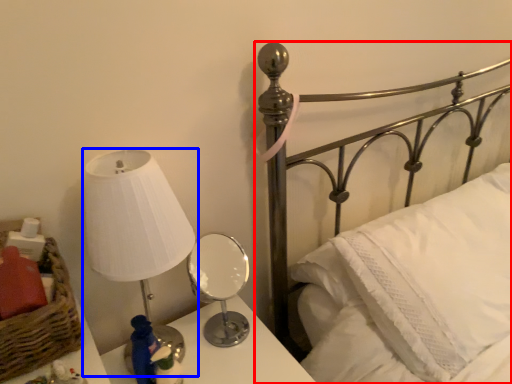
Question: Among these objects, which one is farthest to the camera, bed (highlighted by a red box) or lamp (highlighted by a blue box)?

Choices:
 (A) bed
 (B) lamp

Answer: (B)